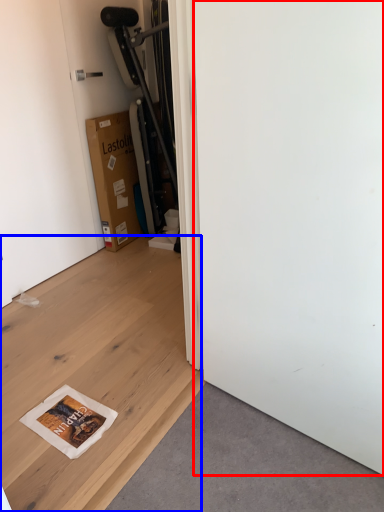
Question: Which point is further to the camera, screen door (highlighted by a red box) or plywood (highlighted by a blue box)?

Choices:
 (A) screen door
 (B) plywood

Answer: (B)